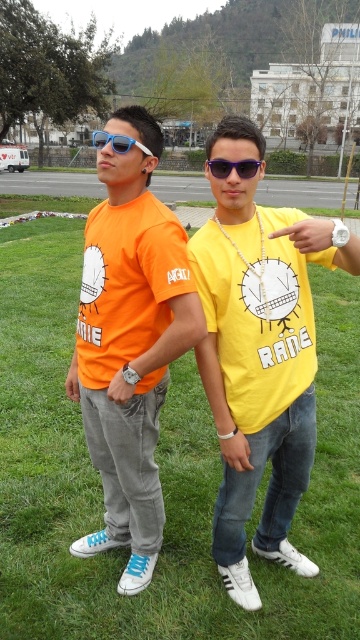
Between green grass at center and yellow matte shirt at center, which one is positioned higher?

green grass at center is above.

Can you confirm if green grass at center is positioned below yellow matte shirt at center?

No.

Which is behind, point (348, 353) or point (257, 156)?

Point (348, 353)

Where is `green grass at center`? This screenshot has width=360, height=640. green grass at center is located at coordinates (159, 477).

Is matte orange t-shirt at center bigger than sunglasses at center?

Yes, matte orange t-shirt at center is bigger than sunglasses at center.

The image size is (360, 640). Find the location of `matte orange t-shirt at center`. matte orange t-shirt at center is located at coordinates (129, 342).

Between point (38, 577) and point (151, 381), which one is positioned in front?

Point (151, 381)

Measure the distance from green grass at center to matte orange t-shirt at center.

green grass at center and matte orange t-shirt at center are 3.06 meters apart.

Does point (5, 604) lie in front of point (128, 435)?

No, it is behind (128, 435).

This screenshot has width=360, height=640. What are the coordinates of `green grass at center` in the screenshot? It's located at (159, 477).